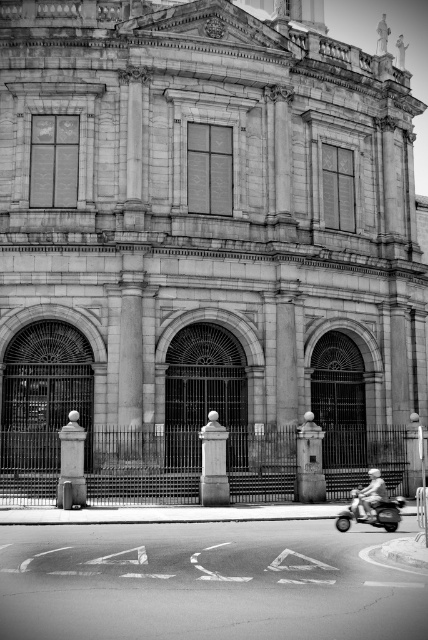
Based on the photo, between shiny metallic motorcycle at lower right and light brown leather jacket at lower right, which one appears on the left side from the viewer's perspective?

From the viewer's perspective, shiny metallic motorcycle at lower right appears more on the left side.

Can you confirm if shiny metallic motorcycle at lower right is shorter than light brown leather jacket at lower right?

Yes, shiny metallic motorcycle at lower right is shorter than light brown leather jacket at lower right.

Describe the element at coordinates (371, 513) in the screenshot. I see `shiny metallic motorcycle at lower right` at that location.

The height and width of the screenshot is (640, 428). I want to click on shiny metallic motorcycle at lower right, so click(371, 513).